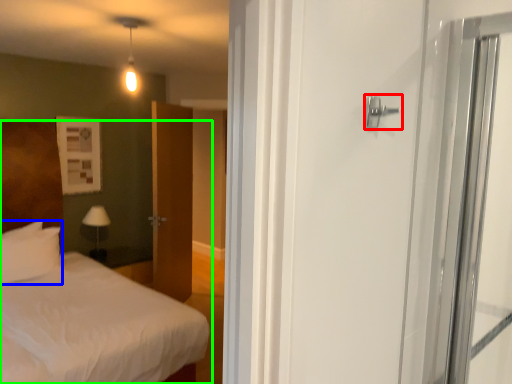
Question: Which object is positioned closest to door handle (highlighted by a red box)? Select from pillow (highlighted by a blue box) and bed (highlighted by a green box).

Choices:
 (A) pillow
 (B) bed

Answer: (A)